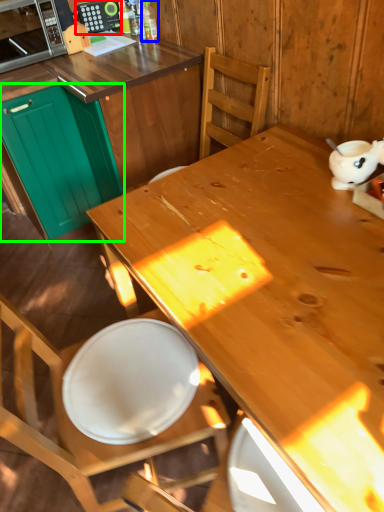
Question: Which object is positioned closest to appliance (highlighted by a red box)? Select from bottle (highlighted by a blue box) and cabinetry (highlighted by a green box).

Choices:
 (A) bottle
 (B) cabinetry

Answer: (A)